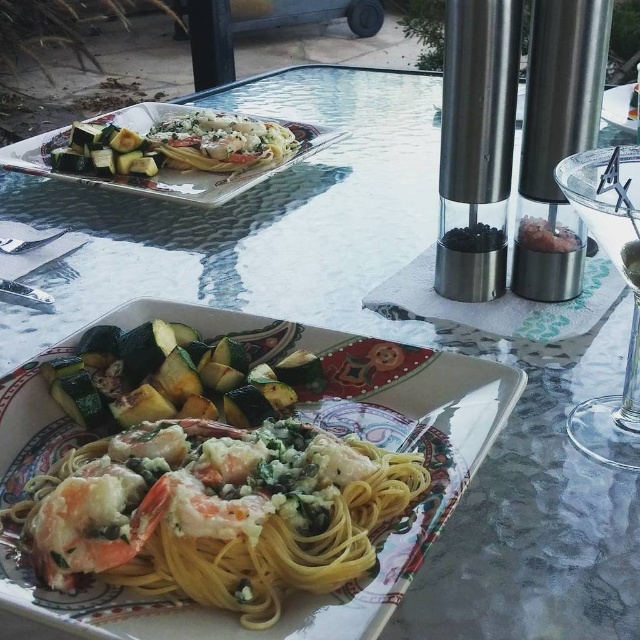
Question: Considering the real-world distances, which object is closest to the white creamy pasta at upper center?

Choices:
 (A) matte glass platter at upper left
 (B) brown crumbly bread at upper right
 (C) green matte zucchini at left
 (D) transparent glass at right

Answer: (A)

Question: From the image, what is the correct spatial relationship of matte glass platter at upper left in relation to brown crumbly bread at upper right?

Choices:
 (A) below
 (B) above

Answer: (B)

Question: Which object appears farthest from the camera in this image?

Choices:
 (A) transparent glass at right
 (B) brown crumbly bread at upper right

Answer: (B)

Question: Can you confirm if green matte zucchini at lower left is positioned to the left of white creamy pasta at upper center?

Choices:
 (A) yes
 (B) no

Answer: (B)

Question: Can you confirm if yellow matte pasta at center is smaller than white creamy pasta at upper center?

Choices:
 (A) no
 (B) yes

Answer: (A)

Question: Among these points, which one is nearest to the camera?

Choices:
 (A) (540, 250)
 (B) (90, 122)
 (C) (314, 337)
 (D) (621, 253)

Answer: (D)